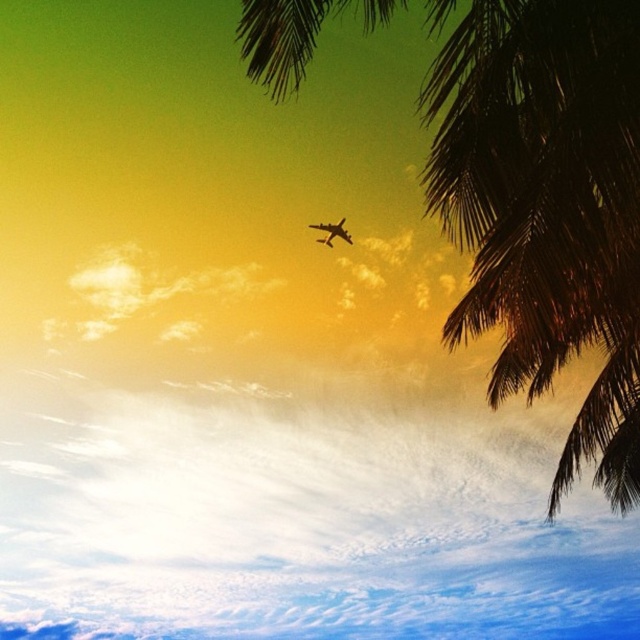
You are an airplane pilot flying the metallic airplane at upper center. You notice the dark green leafy palm tree at upper right in your path. Can you determine if your airplane can safely pass between the palm tree and another object without adjusting your current course?

The dark green leafy palm tree at upper right might be wider than the metallic airplane at upper center, so there may not be enough space to safely pass between them without adjusting course.

You are an astronomer observing the sky and see two points of light in the scene. One is at point (534, 273) and the other at point (330, 241). Which point is closer to you?

Point (534, 273) is in front of point (330, 241), so the point at (534, 273) is closer to you.

You are an astronomer analyzing the image of the sky. You notice a specific point at coordinates point (547, 205). Based on the scene description, what object is this point located on?

The point (547, 205) is on the dark green leafy palm tree at upper right.